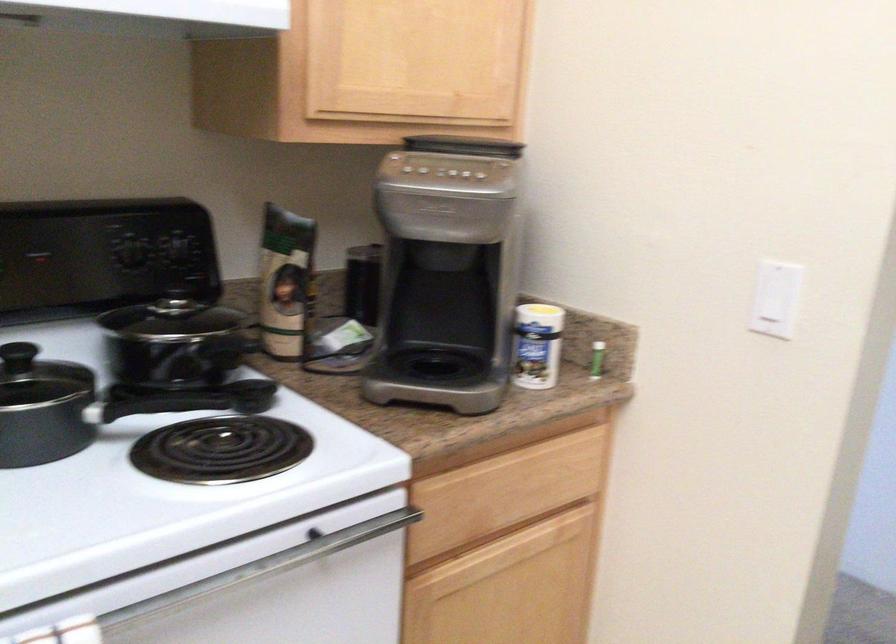
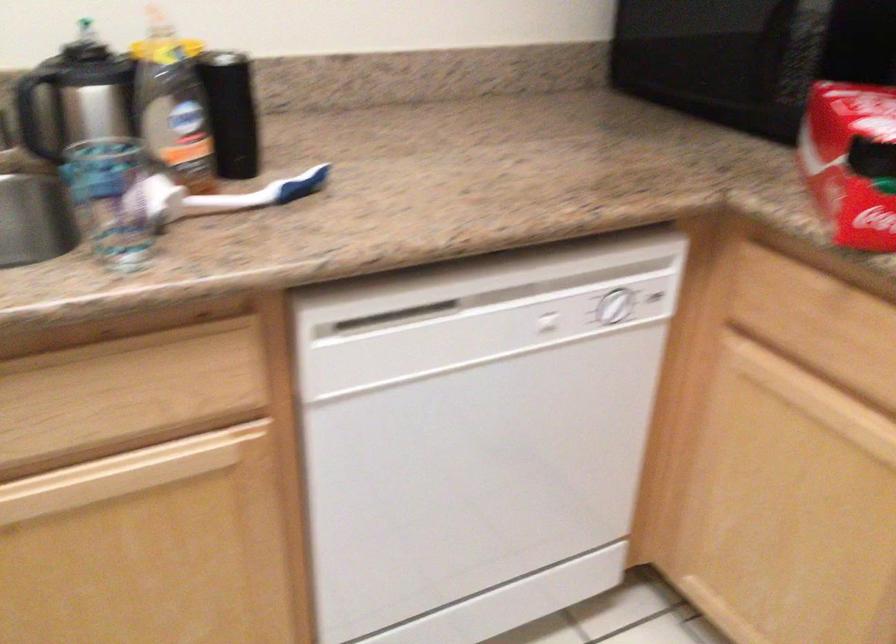
The first image is from the beginning of the video and the second image is from the end. How did the camera likely rotate when shooting the video?

The camera rotated toward left-down.